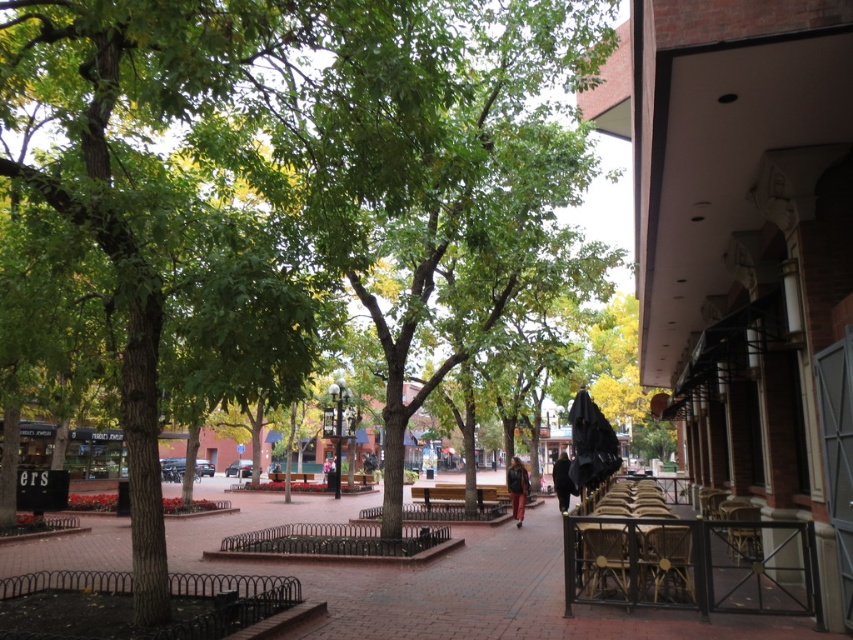
You are a delivery person trying to place a large package on the brick pavement at center. The package is taller than the rattan chair at lower right. Can the package be placed there without exceeding the height limit?

The brick pavement at center is taller than the rattan chair at lower right. Since the package is taller than the rattan chair at lower right, it can be placed on the brick pavement at center as its height is sufficient to accommodate the package.

You are a delivery person trying to place a small package on the wooden chair at lower right and the matte black jacket at center. Which surface can accommodate the package without it falling off?

The wooden chair at lower right is bigger than the matte black jacket at center, so the wooden chair at lower right can accommodate the package without it falling off.

You are a customer looking for a seat in the plaza. You see two wooden chairs, the wooden chair at lower right and the wooden chair at right. Which chair is positioned more to the left side of the plaza?

The wooden chair at lower right is positioned more to the left side of the plaza because it is to the left of the wooden chair at right.